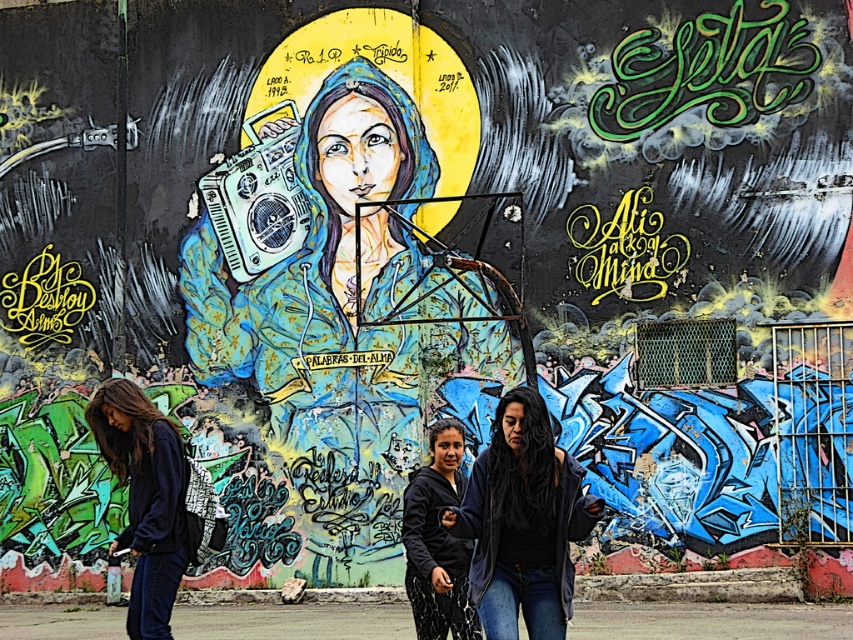
Is the position of dark blue jacket at lower left more distant than that of metallic blue boombox at center?

That is False.

Does dark blue jacket at lower left have a lesser height compared to metallic blue boombox at center?

Indeed, dark blue jacket at lower left has a lesser height compared to metallic blue boombox at center.

What do you see at coordinates (144, 499) in the screenshot? Image resolution: width=853 pixels, height=640 pixels. I see `dark blue jacket at lower left` at bounding box center [144, 499].

Identify the location of dark blue jacket at lower left. The width and height of the screenshot is (853, 640). (144, 499).

Measure the distance between point (531, 516) and camera.

Point (531, 516) is 7.83 meters away from camera.

At what (x,y) coordinates should I click in order to perform the action: click on dark blue denim jeans at center. Please return your answer as a coordinate pair (x, y). Looking at the image, I should click on (521, 522).

Who is more forward, (476, 467) or (236, 224)?

Point (476, 467) is more forward.

Between dark blue denim jeans at center and metallic blue boombox at center, which one appears on the right side from the viewer's perspective?

dark blue denim jeans at center is more to the right.

Is point (473, 493) positioned before point (283, 157)?

Yes, point (473, 493) is closer to viewer.

Identify the location of dark blue denim jeans at center. (521, 522).